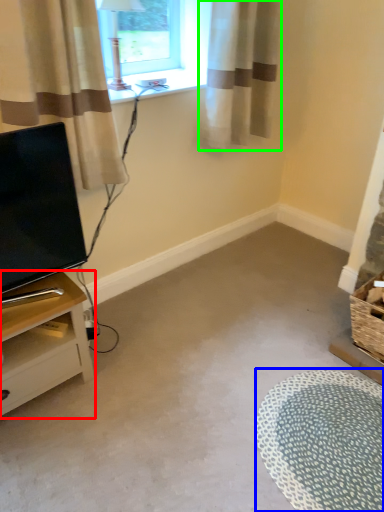
Question: Which object is the closest to the nightstand (highlighted by a red box)? Choose among these: flat (highlighted by a blue box) or curtain (highlighted by a green box).

Choices:
 (A) flat
 (B) curtain

Answer: (A)